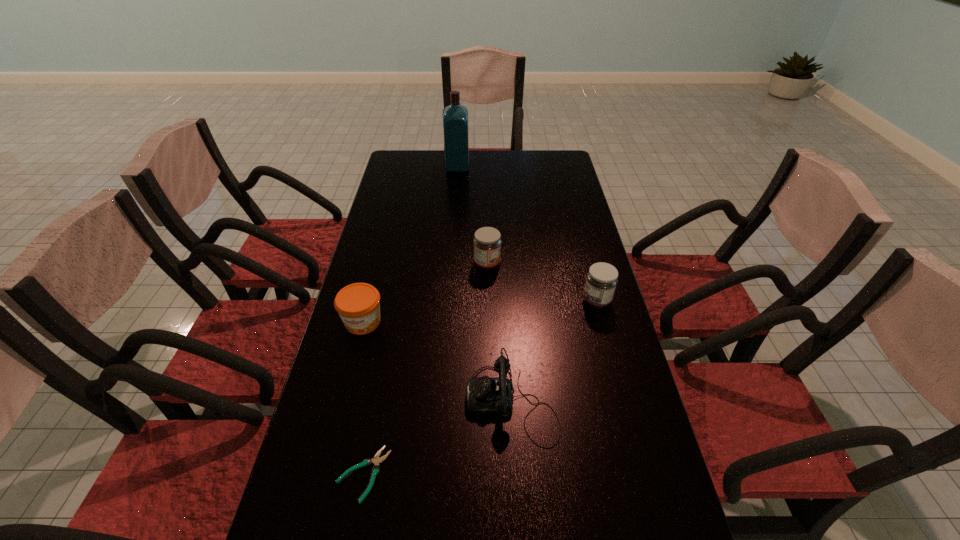
Locate an element on the screen. pliers that is at the left edge is located at coordinates (376, 460).

Locate an element on the screen. This screenshot has height=540, width=960. object that is positioned at the right edge is located at coordinates (602, 278).

The image size is (960, 540). Find the location of `vacant area at the far edge`. vacant area at the far edge is located at coordinates point(455,174).

This screenshot has height=540, width=960. In order to click on vacant space at the left edge in this screenshot , I will do `click(393, 195)`.

This screenshot has height=540, width=960. In the image, there is a desktop. In order to click on vacant area at the right edge in this screenshot , I will do `click(590, 485)`.

Identify the location of free region at the far right corner of the desktop. The height and width of the screenshot is (540, 960). (563, 170).

Locate an element on the screen. empty space between the farthest object and the shortest object is located at coordinates (411, 321).

Find the location of `empty location between the shortest jam and the second jam from right to left`. empty location between the shortest jam and the second jam from right to left is located at coordinates (425, 293).

The height and width of the screenshot is (540, 960). I want to click on free space between the shortest jam and the liquor, so click(x=410, y=244).

I want to click on free space between the farthest object and the farthest jam, so click(472, 215).